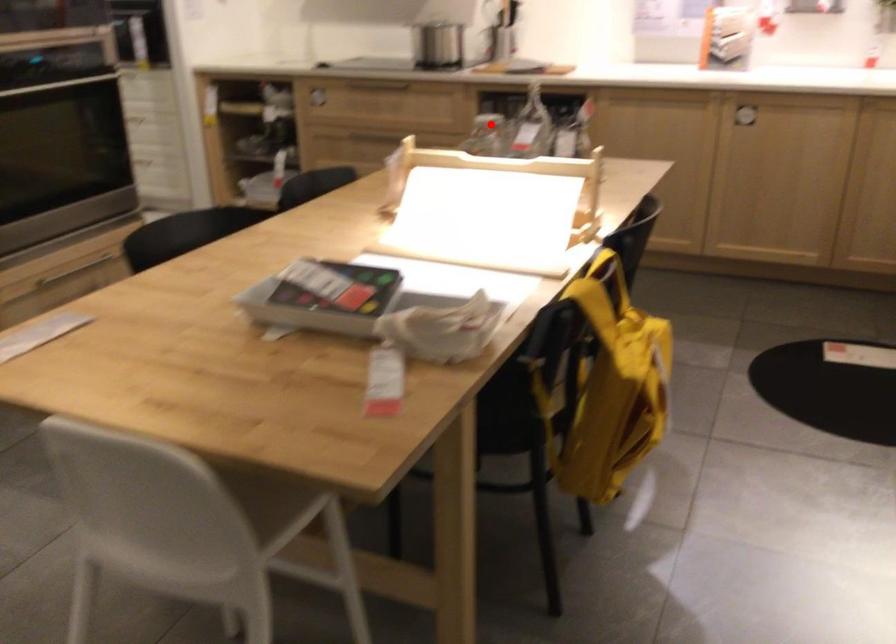
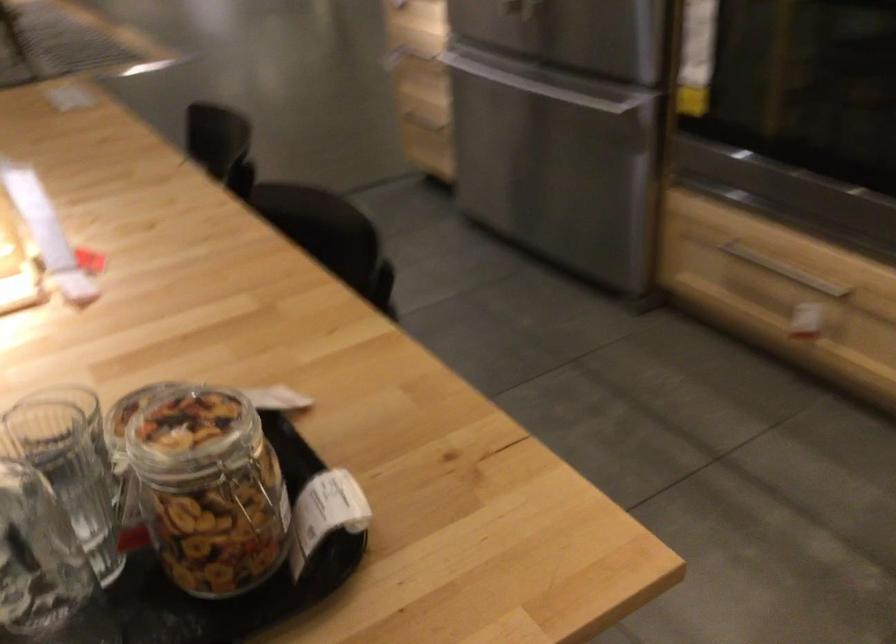
Question: I am providing you with two images of the same scene from different viewpoints. Image1 has a red point marked. In image2, the corresponding 3D location appears at what relative position? Reply with the corresponding letter.

Choices:
 (A) Closer
 (B) Farther

Answer: (A)